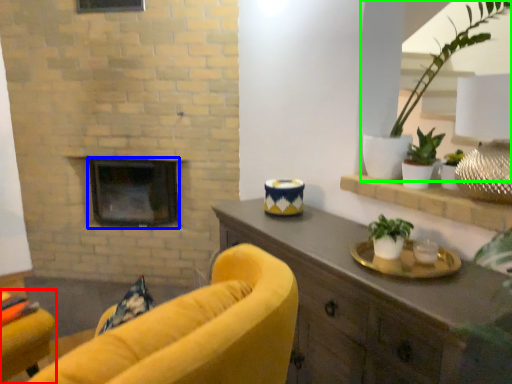
Question: Which is nearer to the chair (highlighted by a red box)? fireplace (highlighted by a blue box) or houseplant (highlighted by a green box).

Choices:
 (A) fireplace
 (B) houseplant

Answer: (A)